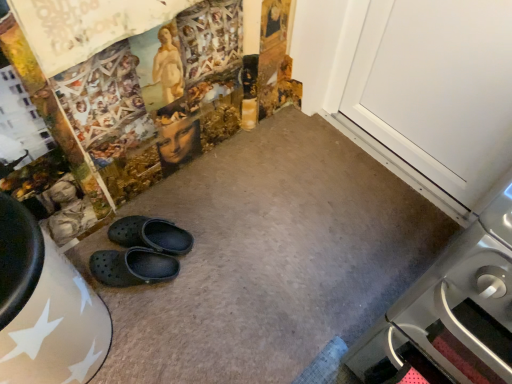
Question: Is stainless steel oven at lower right smaller than white smooth door at upper right?

Choices:
 (A) yes
 (B) no

Answer: (B)

Question: Does stainless steel oven at lower right have a lesser height compared to white smooth door at upper right?

Choices:
 (A) yes
 (B) no

Answer: (B)

Question: From a real-world perspective, is stainless steel oven at lower right positioned under white smooth door at upper right based on gravity?

Choices:
 (A) no
 (B) yes

Answer: (A)

Question: Would you consider stainless steel oven at lower right to be distant from white smooth door at upper right?

Choices:
 (A) yes
 (B) no

Answer: (B)

Question: Does stainless steel oven at lower right appear on the right side of white smooth door at upper right?

Choices:
 (A) no
 (B) yes

Answer: (B)

Question: From the image's perspective, is stainless steel oven at lower right above or below black rubber clogs at lower left, marked as the 2th footwear in a bottom-to-top arrangement?

Choices:
 (A) below
 (B) above

Answer: (A)

Question: In terms of height, does stainless steel oven at lower right look taller or shorter compared to black rubber clogs at lower left, which appears as the first footwear when viewed from the top?

Choices:
 (A) short
 (B) tall

Answer: (B)

Question: In terms of width, does stainless steel oven at lower right look wider or thinner when compared to black rubber clogs at lower left, marked as the 2th footwear in a bottom-to-top arrangement?

Choices:
 (A) thin
 (B) wide

Answer: (B)

Question: Would you say stainless steel oven at lower right is inside or outside black rubber clogs at lower left, which appears as the first footwear when viewed from the top?

Choices:
 (A) outside
 (B) inside

Answer: (A)

Question: From a real-world perspective, is white smooth door at upper right physically located above or below stainless steel oven at lower right?

Choices:
 (A) above
 (B) below

Answer: (B)

Question: Is white smooth door at upper right taller or shorter than stainless steel oven at lower right?

Choices:
 (A) short
 (B) tall

Answer: (A)

Question: Is white smooth door at upper right in front of or behind stainless steel oven at lower right in the image?

Choices:
 (A) front
 (B) behind

Answer: (B)

Question: Is white smooth door at upper right situated inside stainless steel oven at lower right or outside?

Choices:
 (A) outside
 (B) inside

Answer: (A)

Question: Is point (489, 367) positioned closer to the camera than point (100, 269)?

Choices:
 (A) farther
 (B) closer

Answer: (B)

Question: From a real-world perspective, is stainless steel oven at lower right physically located above or below black rubber clogs at center, the first footwear ordered from the bottom?

Choices:
 (A) above
 (B) below

Answer: (A)